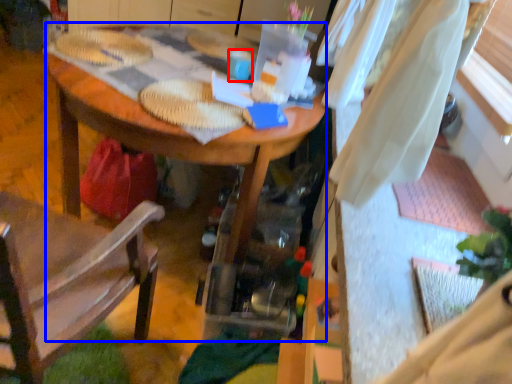
Question: Among these objects, which one is farthest to the camera, coffee cup (highlighted by a red box) or desk (highlighted by a blue box)?

Choices:
 (A) coffee cup
 (B) desk

Answer: (A)